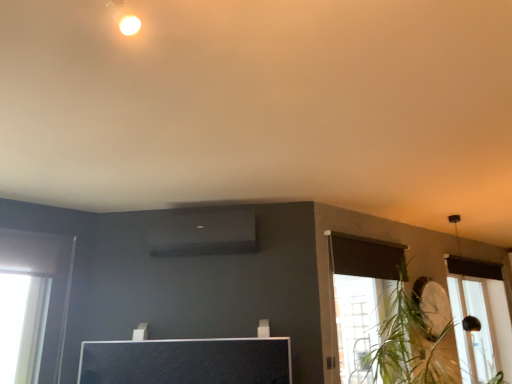
From the picture: What is the approximate height of transparent glass window at lower right?

transparent glass window at lower right is 3.80 feet tall.

Image resolution: width=512 pixels, height=384 pixels. What do you see at coordinates (480, 318) in the screenshot?
I see `transparent glass window at lower right` at bounding box center [480, 318].

This screenshot has width=512, height=384. In order to click on transparent glass window at lower right in this screenshot , I will do `click(480, 318)`.

Consider the image. What is the approximate width of transparent glass window at lower right?

transparent glass window at lower right is 3.93 inches in width.

What do you see at coordinates (417, 335) in the screenshot?
I see `green leafy plant at right` at bounding box center [417, 335].

I want to click on green leafy plant at right, so click(x=417, y=335).

Where is `transparent glass window at lower right`? The image size is (512, 384). transparent glass window at lower right is located at coordinates (480, 318).

Which is more to the right, green leafy plant at right or transparent glass window at lower right?

From the viewer's perspective, transparent glass window at lower right appears more on the right side.

From the picture: Does green leafy plant at right come behind transparent glass window at lower right?

No.

Is point (438, 354) positioned in front of point (448, 255)?

Yes, point (438, 354) is closer to viewer.

Looking at this image, from the image's perspective, is green leafy plant at right under transparent glass window at lower right?

Incorrect, from the image's perspective, green leafy plant at right is higher than transparent glass window at lower right.

From a real-world perspective, which is physically above, green leafy plant at right or transparent glass window at lower right?

green leafy plant at right is physically above.

Between green leafy plant at right and transparent glass window at lower right, which one has smaller width?

transparent glass window at lower right is thinner.

Considering the sizes of green leafy plant at right and transparent glass window at lower right in the image, is green leafy plant at right taller or shorter than transparent glass window at lower right?

In the image, green leafy plant at right appears to be shorter than transparent glass window at lower right.

Which of these two, green leafy plant at right or transparent glass window at lower right, is bigger?

Bigger between the two is green leafy plant at right.

Is transparent glass window at lower right located within green leafy plant at right?

No, green leafy plant at right does not contain transparent glass window at lower right.

Is there a large distance between green leafy plant at right and transparent glass window at lower right?

No.

Could you tell me if green leafy plant at right is turned towards transparent glass window at lower right?

No, green leafy plant at right is not aimed at transparent glass window at lower right.

At what (x,y) coordinates should I click in order to perform the action: click on window behind the green leafy plant at right. Please return your answer as a coordinate pair (x, y). The width and height of the screenshot is (512, 384). Looking at the image, I should click on (480, 318).

Is transparent glass window at lower right to the left or to the right of green leafy plant at right in the image?

transparent glass window at lower right is to the right of green leafy plant at right.

Which object is further away from the camera, transparent glass window at lower right or green leafy plant at right?

transparent glass window at lower right is further from the camera.

Is point (506, 333) positioned after point (413, 374)?

That is True.

From the image's perspective, between transparent glass window at lower right and green leafy plant at right, who is located below?

transparent glass window at lower right, from the image's perspective.

From a real-world perspective, between transparent glass window at lower right and green leafy plant at right, who is vertically higher?

green leafy plant at right, from a real-world perspective.

Is transparent glass window at lower right wider than green leafy plant at right?

In fact, transparent glass window at lower right might be narrower than green leafy plant at right.

Considering the sizes of transparent glass window at lower right and green leafy plant at right in the image, is transparent glass window at lower right taller or shorter than green leafy plant at right?

Considering their sizes, transparent glass window at lower right has more height than green leafy plant at right.

Which of these two, transparent glass window at lower right or green leafy plant at right, is bigger?

green leafy plant at right is bigger.

Consider the image. Would you say transparent glass window at lower right is inside or outside green leafy plant at right?

transparent glass window at lower right is not enclosed by green leafy plant at right.

Is transparent glass window at lower right not close to green leafy plant at right?

transparent glass window at lower right is actually quite close to green leafy plant at right.

Is transparent glass window at lower right positioned with its back to green leafy plant at right?

transparent glass window at lower right does not have its back to green leafy plant at right.

What's the angular difference between transparent glass window at lower right and green leafy plant at right's facing directions?

The angle between the facing direction of transparent glass window at lower right and the facing direction of green leafy plant at right is 2.32 degrees.

Find the location of `window located on the right of green leafy plant at right`. window located on the right of green leafy plant at right is located at coordinates (480, 318).

The height and width of the screenshot is (384, 512). In order to click on window located underneath the green leafy plant at right (from a real-world perspective) in this screenshot , I will do `click(480, 318)`.

Locate an element on the screen. Image resolution: width=512 pixels, height=384 pixels. window on the right of the green leafy plant at right is located at coordinates (480, 318).